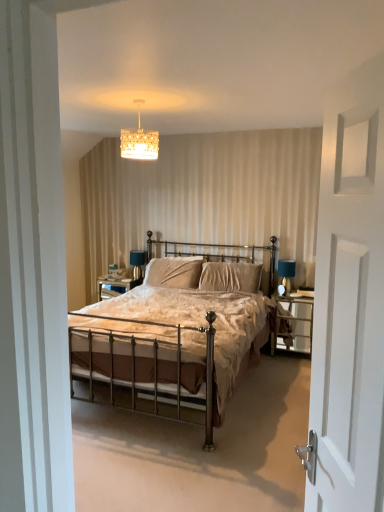
What are the coordinates of `empty space that is ontop of matte black table lamp at right (from a real-world perspective)` in the screenshot? It's located at (294, 257).